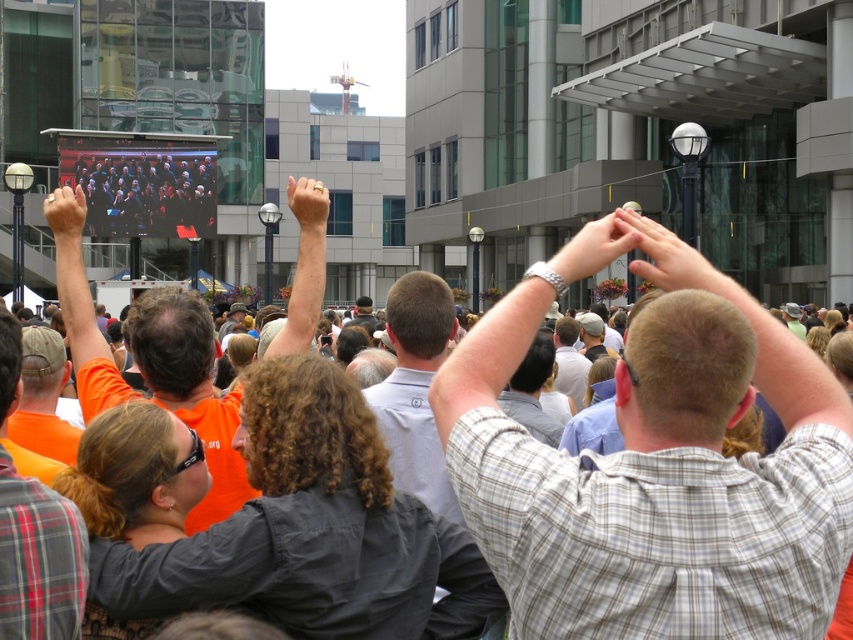
Question: Is plaid shirt at upper right positioned before matte black hand at upper left?

Choices:
 (A) no
 (B) yes

Answer: (B)

Question: Does orange fabric arm at upper left appear under smooth skin hand at upper center?

Choices:
 (A) no
 (B) yes

Answer: (B)

Question: Which of the following is the closest to the observer?

Choices:
 (A) matte orange shirt at center
 (B) smooth skin hand at upper center
 (C) orange t-shirt at upper left

Answer: (C)

Question: Among these points, which one is farthest from the camera?

Choices:
 (A) (9, 349)
 (B) (596, 260)
 (C) (151, 328)
 (D) (70, 195)

Answer: (D)

Question: Which of the following is the closest to the observer?

Choices:
 (A) smooth skin hand at upper center
 (B) matte orange shirt at center

Answer: (A)

Question: Is orange fabric shirt at center bigger than matte black hand at upper left?

Choices:
 (A) yes
 (B) no

Answer: (A)